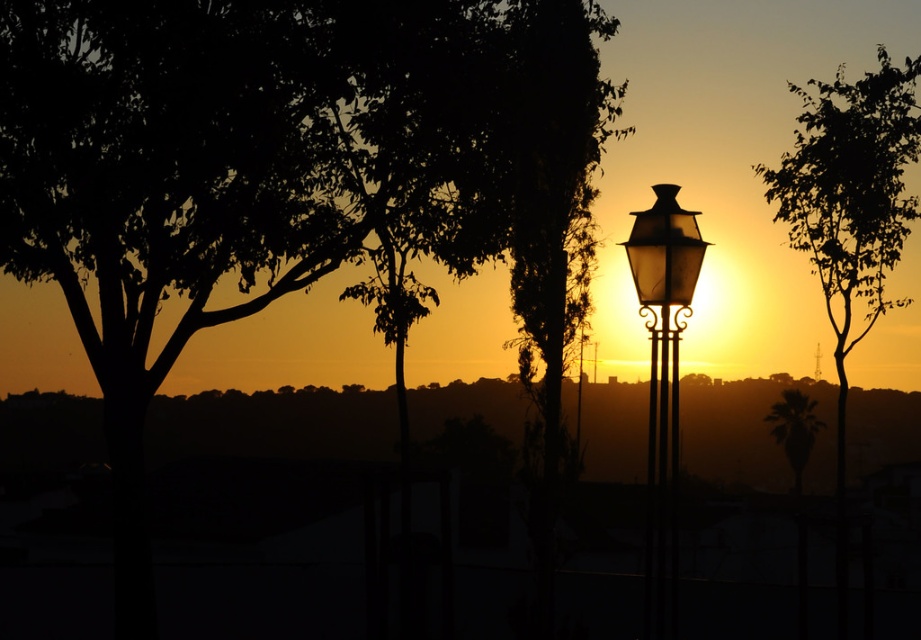
Question: Estimate the real-world distances between objects in this image. Which object is closer to the silhouette palm tree at center?

Choices:
 (A) green leafy tree at upper right
 (B) metallic lantern at center
 (C) translucent glass street light at center

Answer: (A)

Question: Is translucent glass street light at center behind metallic lantern at center?

Choices:
 (A) no
 (B) yes

Answer: (A)

Question: Which object appears closest to the camera in this image?

Choices:
 (A) silhouette palm tree at center
 (B) green leafy tree at upper right

Answer: (B)

Question: From the image, what is the correct spatial relationship of green leafy tree at upper right in relation to translucent glass street light at center?

Choices:
 (A) above
 (B) below

Answer: (A)

Question: Which point is closer to the camera?

Choices:
 (A) (888, 208)
 (B) (684, 326)
 (C) (691, 250)

Answer: (B)

Question: Can you confirm if translucent glass street light at center is positioned to the right of silhouette palm tree at center?

Choices:
 (A) no
 (B) yes

Answer: (A)